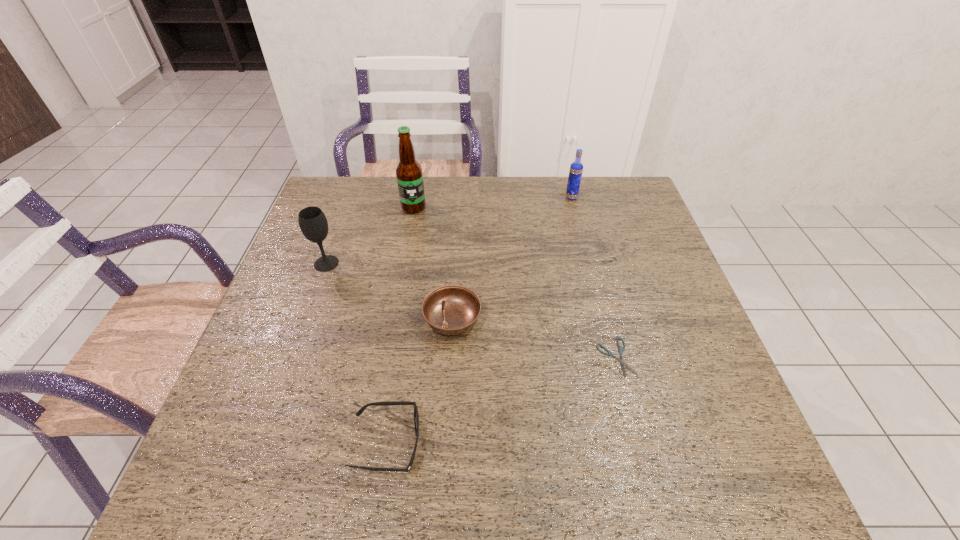
Where is `vacant space located on the front of the soup bowl`? vacant space located on the front of the soup bowl is located at coordinates (446, 420).

Locate an element on the screen. This screenshot has height=540, width=960. blank space located on the front-facing side of the sunglasses is located at coordinates (592, 444).

Locate an element on the screen. This screenshot has width=960, height=540. vacant point located on the left of the shortest object is located at coordinates (505, 358).

At what (x,y) coordinates should I click in order to perform the action: click on beer bottle at the far edge. Please return your answer as a coordinate pair (x, y). This screenshot has width=960, height=540. Looking at the image, I should click on (409, 175).

Where is `vodka that is at the far edge`? The width and height of the screenshot is (960, 540). vodka that is at the far edge is located at coordinates (576, 168).

In order to click on object present at the near edge in this screenshot , I will do `click(416, 417)`.

At what (x,y) coordinates should I click in order to perform the action: click on object that is at the left edge. Please return your answer as a coordinate pair (x, y). Image resolution: width=960 pixels, height=540 pixels. Looking at the image, I should click on pyautogui.click(x=312, y=221).

Image resolution: width=960 pixels, height=540 pixels. Find the location of `vacant space at the far edge`. vacant space at the far edge is located at coordinates (514, 208).

Find the location of `blank space at the near edge of the desktop`. blank space at the near edge of the desktop is located at coordinates (543, 495).

Locate an element on the screen. vacant space at the left edge of the desktop is located at coordinates (295, 256).